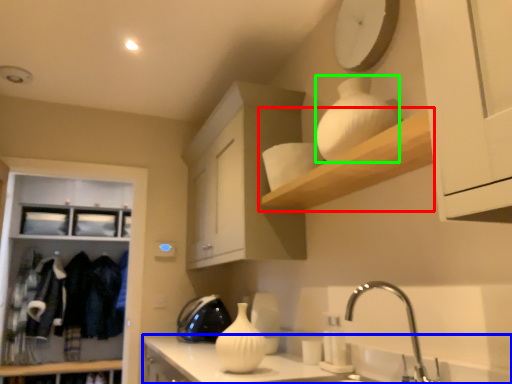
Question: Which object is the farthest from shelf (highlighted by a red box)? Choose among these: countertop (highlighted by a blue box) or glass vase (highlighted by a green box).

Choices:
 (A) countertop
 (B) glass vase

Answer: (A)